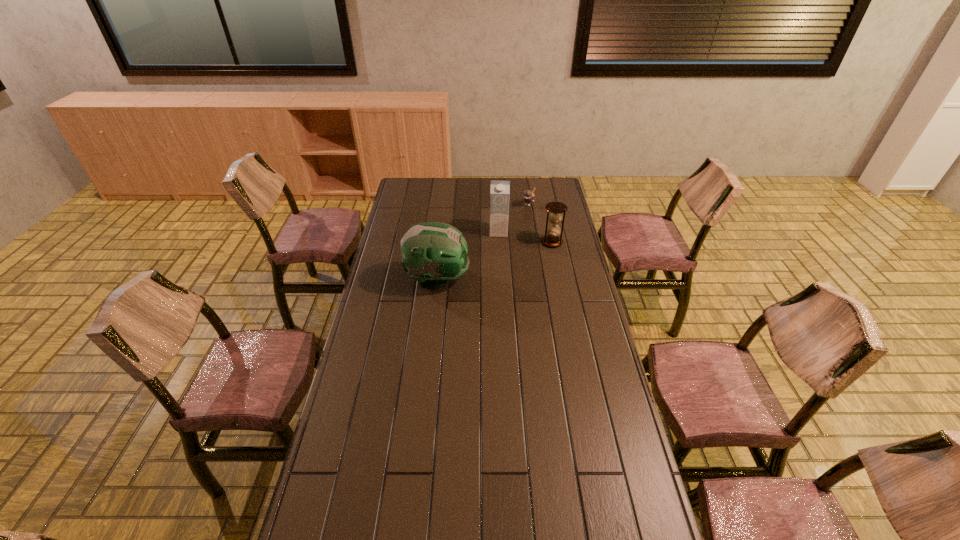
I want to click on free space at the near edge of the desktop, so click(x=568, y=519).

Find the location of `vacant space at the left edge of the desktop`. vacant space at the left edge of the desktop is located at coordinates (386, 364).

The height and width of the screenshot is (540, 960). In the image, there is a desktop. Find the location of `vacant area at the right edge`. vacant area at the right edge is located at coordinates (565, 214).

This screenshot has height=540, width=960. In the image, there is a desktop. Identify the location of vacant area at the far left corner. (426, 195).

Image resolution: width=960 pixels, height=540 pixels. What are the coordinates of `vacant space at the far right corner` in the screenshot? It's located at (556, 181).

Image resolution: width=960 pixels, height=540 pixels. Identify the location of unoccupied area between the second object from left to right and the shortest object. (514, 218).

Where is `unoccupied area between the leftmost object and the carton`? This screenshot has height=540, width=960. unoccupied area between the leftmost object and the carton is located at coordinates [x=468, y=256].

Locate an element on the screen. The width and height of the screenshot is (960, 540). free area in between the football helmet and the second shortest object is located at coordinates (494, 261).

Locate an element on the screen. Image resolution: width=960 pixels, height=540 pixels. vacant point located between the nearest object and the shortest object is located at coordinates click(483, 241).

This screenshot has width=960, height=540. Find the location of `free spot between the hourglass and the farthest object`. free spot between the hourglass and the farthest object is located at coordinates (540, 222).